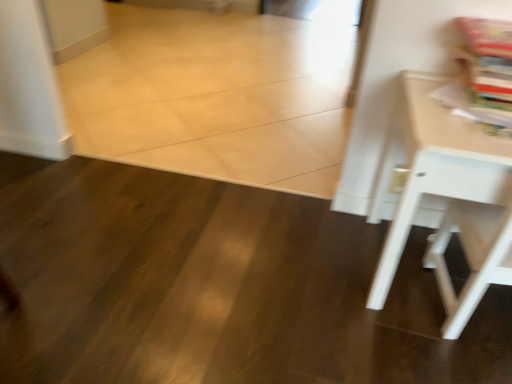
Question: From a real-world perspective, is matte paper magazine at upper right positioned above or below white matte table at right?

Choices:
 (A) above
 (B) below

Answer: (A)

Question: Relative to white matte table at right, is matte paper magazine at upper right in front or behind?

Choices:
 (A) front
 (B) behind

Answer: (B)

Question: From their relative heights in the image, would you say matte paper magazine at upper right is taller or shorter than white matte table at right?

Choices:
 (A) short
 (B) tall

Answer: (A)

Question: Relative to matte paper magazine at upper right, is white matte table at right in front or behind?

Choices:
 (A) front
 (B) behind

Answer: (A)

Question: Looking at their shapes, would you say white matte table at right is wider or thinner than matte paper magazine at upper right?

Choices:
 (A) thin
 (B) wide

Answer: (B)

Question: From a real-world perspective, is white matte table at right above or below matte paper magazine at upper right?

Choices:
 (A) above
 (B) below

Answer: (B)

Question: Is white matte table at right taller or shorter than matte paper magazine at upper right?

Choices:
 (A) tall
 (B) short

Answer: (A)